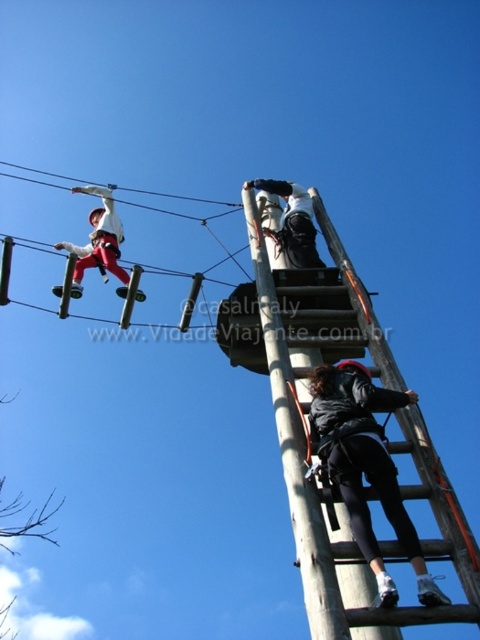
Question: Is wooden ladder at center positioned before matte white helmet at upper left?

Choices:
 (A) no
 (B) yes

Answer: (B)

Question: Which point appears closest to the camera in this image?

Choices:
 (A) (288, 193)
 (B) (88, 256)
 (C) (396, 525)

Answer: (C)

Question: Estimate the real-world distances between objects in this image. Which object is closer to the wooden ladder at center?

Choices:
 (A) white matte helmet at upper center
 (B) wooden pole at upper center

Answer: (B)

Question: Which object is the closest to the wooden pole at upper center?

Choices:
 (A) black matte jacket at center
 (B) white matte helmet at upper center

Answer: (A)

Question: Can you confirm if matte white helmet at upper left is positioned above white matte helmet at upper center?

Choices:
 (A) no
 (B) yes

Answer: (A)

Question: Can you confirm if white matte helmet at upper center is positioned to the right of white rope at upper left?

Choices:
 (A) yes
 (B) no

Answer: (A)